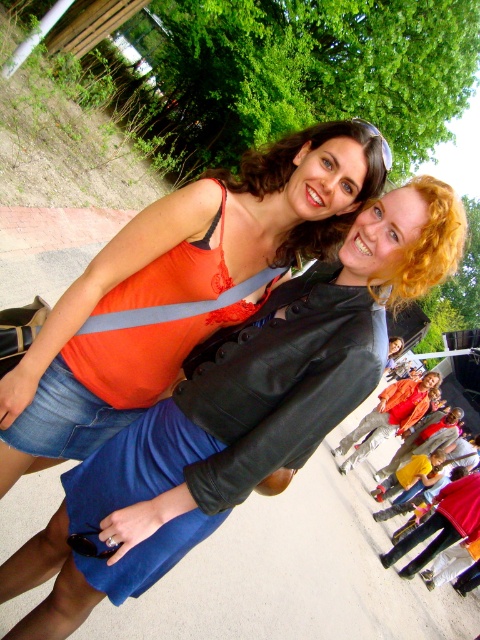
Image resolution: width=480 pixels, height=640 pixels. What do you see at coordinates (88, 545) in the screenshot?
I see `black plastic goggles at lower center` at bounding box center [88, 545].

Is black plastic goggles at lower center thinner than clear plastic goggles at upper center?

Incorrect, black plastic goggles at lower center's width is not less than clear plastic goggles at upper center's.

Between point (96, 548) and point (389, 157), which one is positioned behind?

Positioned behind is point (389, 157).

I want to click on black plastic goggles at lower center, so click(88, 545).

Does point (466, 518) come farther from viewer compared to point (93, 548)?

Yes, it is behind point (93, 548).

Is red fabric jacket at lower right taller than black plastic goggles at lower center?

Indeed, red fabric jacket at lower right has a greater height compared to black plastic goggles at lower center.

Which is in front, point (408, 545) or point (84, 532)?

Point (84, 532) is in front.

Identify the location of red fabric jacket at lower right. The image size is (480, 640). (442, 524).

Can you confirm if matte orange tank top at center is positioned to the right of clear plastic goggles at upper center?

Incorrect, matte orange tank top at center is not on the right side of clear plastic goggles at upper center.

Locate an element on the screen. The image size is (480, 640). matte orange tank top at center is located at coordinates (179, 289).